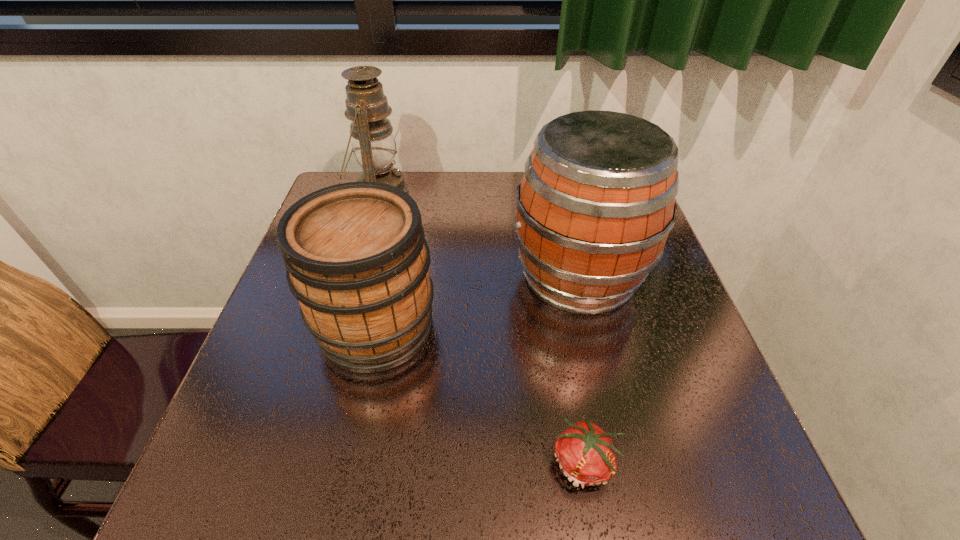
At what (x,y) coordinates should I click in order to perform the action: click on oil lamp. Please return your answer as a coordinate pair (x, y). Looking at the image, I should click on (374, 146).

You are a GUI agent. You are given a task and a screenshot of the screen. Output one action in this format:
    pyautogui.click(x=<x>, y=<y>)
    Task: Click on the right cider
    
    Given the screenshot: What is the action you would take?
    pyautogui.click(x=596, y=203)

At what (x,y) coordinates should I click in order to perform the action: click on the shorter cider. Please return your answer as a coordinate pair (x, y). Looking at the image, I should click on (357, 261).

Find the location of a particular element. the third tallest object is located at coordinates (357, 261).

Where is `tomato`? This screenshot has height=540, width=960. tomato is located at coordinates [586, 455].

Locate an element on the screen. the shortest object is located at coordinates (586, 455).

You are a GUI agent. You are given a task and a screenshot of the screen. Output one action in this format:
    pyautogui.click(x=<x>, y=<y>)
    Task: Click on the vacant space situated 0.310m on the right of the oil lamp
    This screenshot has width=960, height=540.
    Given the screenshot: What is the action you would take?
    515,194

I want to click on free space located 0.310m on the left of the taller cider, so click(x=380, y=276).

Locate an element on the screen. The image size is (960, 540). free space located on the back of the left cider is located at coordinates (399, 221).

This screenshot has width=960, height=540. Identify the location of free spot located 0.370m on the left of the tomato. (326, 463).